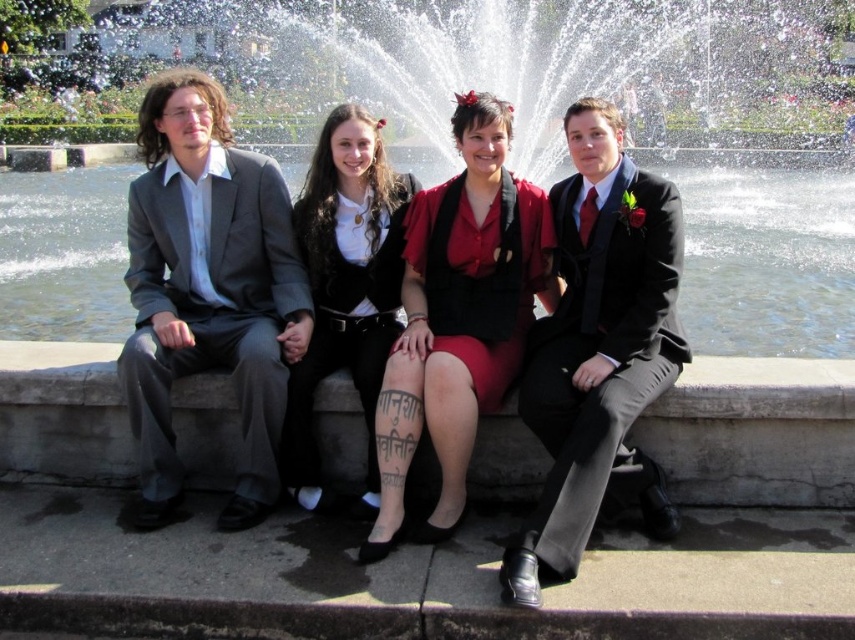
You are a photographer standing in front of the group. You want to take a photo that includes both the matte gray suit at left and the shiny black suit at center. Which suit should you position closer to the left side of the frame to ensure both are visible?

You should position the matte gray suit at left closer to the left side of the frame since it is already to the left of the shiny black suit at center in the scene.

You are a photographer trying to capture a closeup of the clear glass water at center and the matte black vest at center. Since the camera can only focus on one object at a time, which object should you choose to ensure it fills the frame more?

The clear glass water at center is larger in size than the matte black vest at center, so you should choose the clear glass water at center to fill the frame more.

You are a fashion designer observing the group at the fountain. You notice the matte red skirt at center and the matte black vest at center. Which of these two items has a greater surface area?

The matte red skirt at center has a larger size compared to the matte black vest at center, so it has a greater surface area.